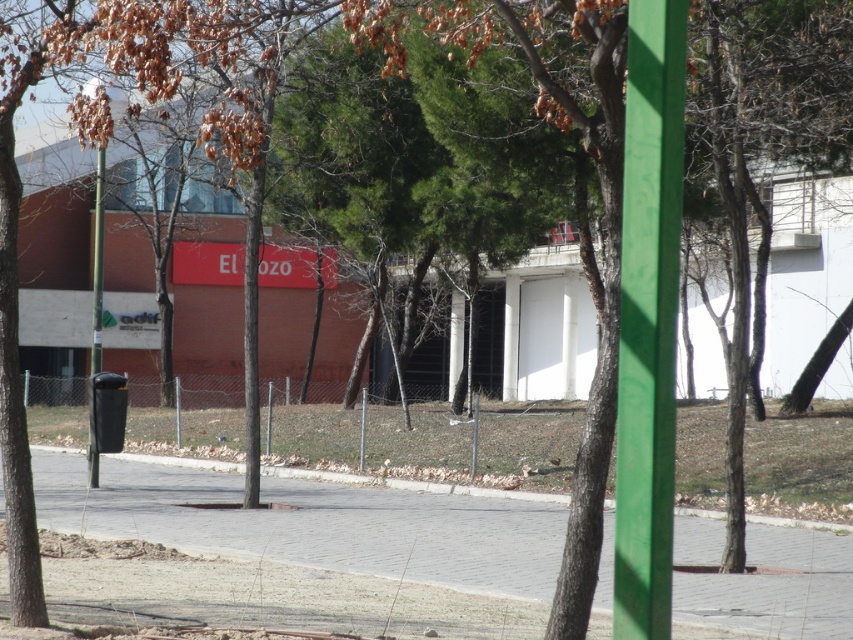
Question: Observing the image, what is the correct spatial positioning of green painted pole at right in reference to black plastic pole at left?

Choices:
 (A) left
 (B) right

Answer: (B)

Question: Does brick pavement at center come behind black plastic pole at left?

Choices:
 (A) yes
 (B) no

Answer: (B)

Question: Considering the real-world distances, which object is farthest from the green painted pole at right?

Choices:
 (A) brick pavement at center
 (B) black plastic pole at left

Answer: (B)

Question: Which object is the farthest from the black plastic pole at left?

Choices:
 (A) brick pavement at center
 (B) green painted pole at right

Answer: (B)

Question: Which object appears closest to the camera in this image?

Choices:
 (A) green painted pole at right
 (B) brick pavement at center

Answer: (A)

Question: Considering the relative positions of brick pavement at center and black plastic pole at left in the image provided, where is brick pavement at center located with respect to black plastic pole at left?

Choices:
 (A) below
 (B) above

Answer: (A)